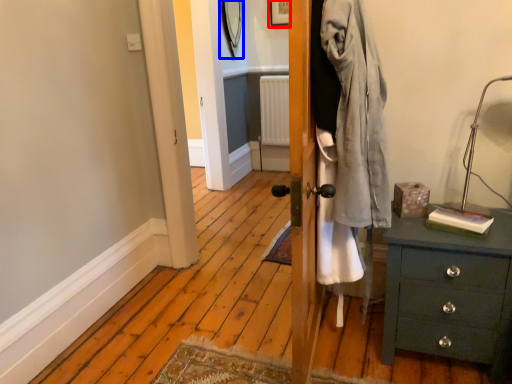
Question: Which point is closer to the camera, picture frame (highlighted by a red box) or mirror (highlighted by a blue box)?

Choices:
 (A) picture frame
 (B) mirror

Answer: (B)